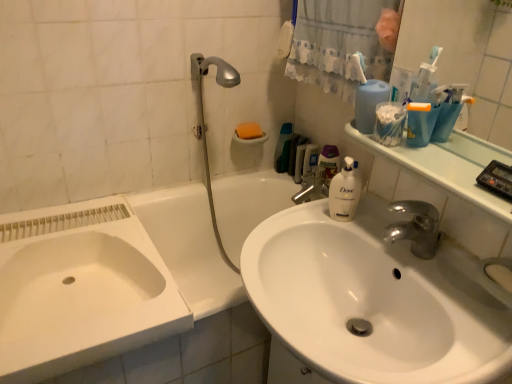
Question: From a real-world perspective, is white glossy sink at center located higher than white fabric shower curtain at upper center?

Choices:
 (A) no
 (B) yes

Answer: (A)

Question: Considering the relative positions of white glossy sink at center and white fabric shower curtain at upper center in the image provided, is white glossy sink at center behind white fabric shower curtain at upper center?

Choices:
 (A) no
 (B) yes

Answer: (A)

Question: Does white glossy sink at center have a smaller size compared to white fabric shower curtain at upper center?

Choices:
 (A) no
 (B) yes

Answer: (A)

Question: Is white glossy sink at center facing away from white fabric shower curtain at upper center?

Choices:
 (A) no
 (B) yes

Answer: (A)

Question: From the image's perspective, is white glossy sink at center on white fabric shower curtain at upper center?

Choices:
 (A) yes
 (B) no

Answer: (B)

Question: In the image, is translucent plastic mouthwash at upper right, acting as the second mouthwash starting from the back, positioned in front of or behind white glossy bottle at upper center, acting as the 1th cleaning product starting from the back?

Choices:
 (A) behind
 (B) front

Answer: (A)

Question: Based on their sizes in the image, would you say translucent plastic mouthwash at upper right, marked as the second mouthwash in a left-to-right arrangement, is bigger or smaller than white glossy bottle at upper center, marked as the second cleaning product in a front-to-back arrangement?

Choices:
 (A) small
 (B) big

Answer: (A)

Question: Is translucent plastic mouthwash at upper right, marked as the second mouthwash in a left-to-right arrangement, to the left or to the right of white glossy bottle at upper center, marked as the second cleaning product in a front-to-back arrangement, in the image?

Choices:
 (A) right
 (B) left

Answer: (B)

Question: From a real-world perspective, relative to white glossy bottle at upper center, marked as the second cleaning product in a front-to-back arrangement, is translucent plastic mouthwash at upper right, marked as the second mouthwash in a left-to-right arrangement, vertically above or below?

Choices:
 (A) above
 (B) below

Answer: (A)

Question: Is white glossy sink at center inside the boundaries of orange sponge at upper center, or outside?

Choices:
 (A) inside
 (B) outside

Answer: (B)

Question: Is white glossy sink at center wider or thinner than orange sponge at upper center?

Choices:
 (A) thin
 (B) wide

Answer: (B)

Question: From the image's perspective, is white glossy sink at center positioned above or below orange sponge at upper center?

Choices:
 (A) below
 (B) above

Answer: (A)

Question: Is white glossy sink at center in front of or behind orange sponge at upper center in the image?

Choices:
 (A) front
 (B) behind

Answer: (A)

Question: Considering the positions of white glossy bathtub at center and blue plastic container at upper right, which is the 2th cleaning product from back to front, in the image, is white glossy bathtub at center bigger or smaller than blue plastic container at upper right, which is the 2th cleaning product from back to front,?

Choices:
 (A) big
 (B) small

Answer: (A)

Question: Considering the relative positions of white glossy bathtub at center and blue plastic container at upper right, which is the 2th cleaning product from back to front, in the image provided, is white glossy bathtub at center to the left or to the right of blue plastic container at upper right, which is the 2th cleaning product from back to front,?

Choices:
 (A) left
 (B) right

Answer: (A)